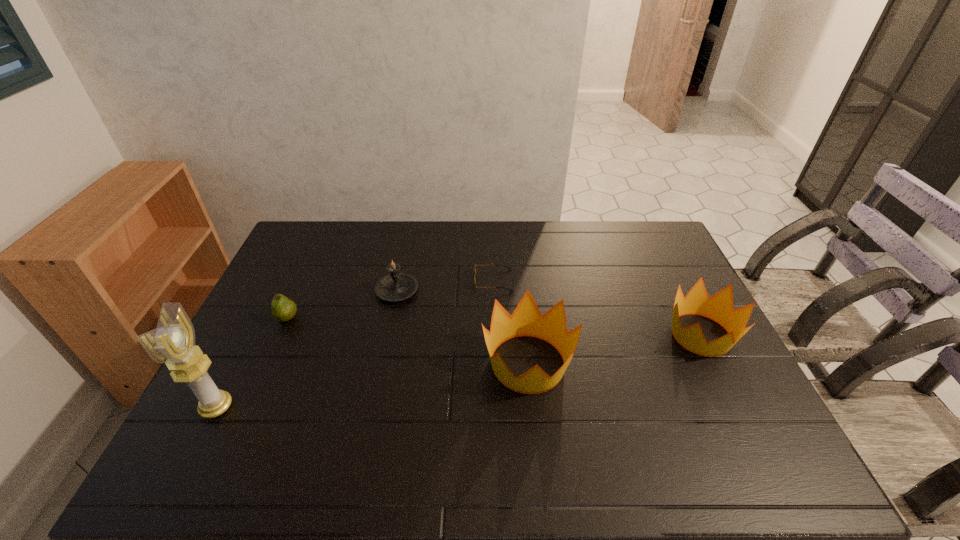
Where is `vacant spot to place a crown on the left`? vacant spot to place a crown on the left is located at coordinates (331, 396).